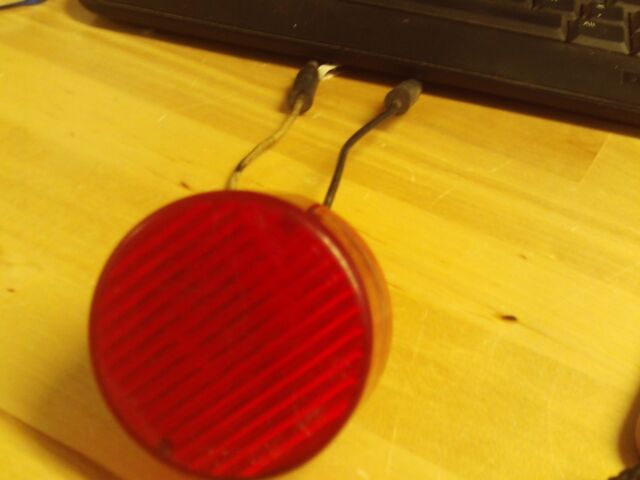
The image size is (640, 480). Identify the location of table. (562, 91), (452, 79).